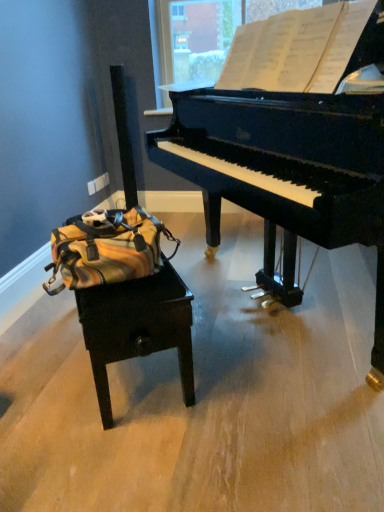
Question: From a real-world perspective, is black polished piano at upper right located beneath white paper at upper center?

Choices:
 (A) no
 (B) yes

Answer: (B)

Question: Is there a large distance between black polished piano at upper right and white paper at upper center?

Choices:
 (A) yes
 (B) no

Answer: (B)

Question: From the image's perspective, would you say black polished piano at upper right is positioned over white paper at upper center?

Choices:
 (A) yes
 (B) no

Answer: (B)

Question: From the image's perspective, does black polished piano at upper right appear lower than white paper at upper center?

Choices:
 (A) no
 (B) yes

Answer: (B)

Question: Is black polished piano at upper right positioned behind white paper at upper center?

Choices:
 (A) no
 (B) yes

Answer: (A)

Question: Is black polished piano at upper right next to white paper at upper center and touching it?

Choices:
 (A) no
 (B) yes

Answer: (A)

Question: Considering the relative sizes of yellow striped fabric messenger bag at left and black polished piano at upper right in the image provided, is yellow striped fabric messenger bag at left smaller than black polished piano at upper right?

Choices:
 (A) yes
 (B) no

Answer: (A)

Question: From a real-world perspective, is yellow striped fabric messenger bag at left located higher than black polished piano at upper right?

Choices:
 (A) no
 (B) yes

Answer: (A)

Question: Is yellow striped fabric messenger bag at left further to camera compared to black polished piano at upper right?

Choices:
 (A) yes
 (B) no

Answer: (A)

Question: Can you confirm if yellow striped fabric messenger bag at left is taller than black polished piano at upper right?

Choices:
 (A) no
 (B) yes

Answer: (A)

Question: Is yellow striped fabric messenger bag at left next to black polished piano at upper right?

Choices:
 (A) no
 (B) yes

Answer: (A)

Question: Is the position of yellow striped fabric messenger bag at left less distant than that of black polished piano at upper right?

Choices:
 (A) yes
 (B) no

Answer: (B)

Question: Does white paper at upper center have a lesser height compared to yellow striped fabric messenger bag at left?

Choices:
 (A) no
 (B) yes

Answer: (A)